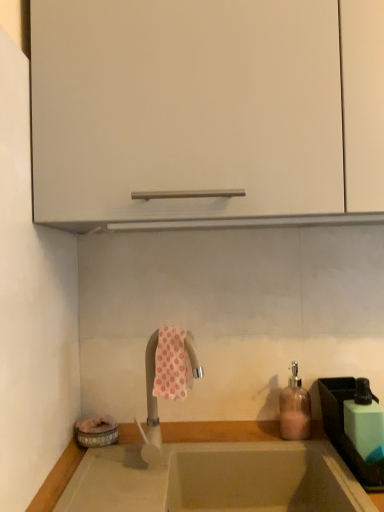
Question: Is green matte soap dispenser at right wider or thinner than smooth beige countertop at lower center?

Choices:
 (A) wide
 (B) thin

Answer: (B)

Question: Considering the relative positions of green matte soap dispenser at right and smooth beige countertop at lower center in the image provided, is green matte soap dispenser at right to the left or to the right of smooth beige countertop at lower center?

Choices:
 (A) left
 (B) right

Answer: (B)

Question: Estimate the real-world distances between objects in this image. Which object is farther from the green matte soap dispenser at right?

Choices:
 (A) pink floral fabric at center
 (B) silver metallic tap at center
 (C) white matte cabinet at upper center
 (D) pink glass soap dispenser at right
 (E) green plastic sink at lower right

Answer: (C)

Question: Which object is positioned closest to the smooth beige countertop at lower center?

Choices:
 (A) green matte soap dispenser at right
 (B) pink floral fabric at center
 (C) white matte cabinet at upper center
 (D) silver metallic tap at center
 (E) green plastic sink at lower right

Answer: (D)